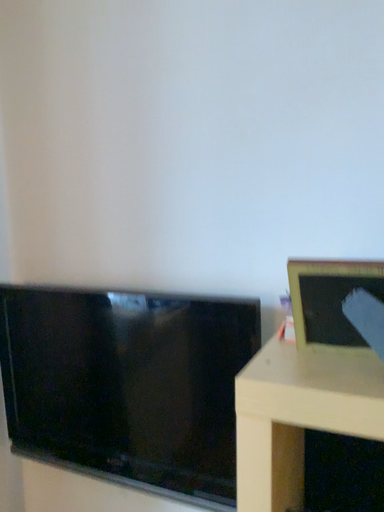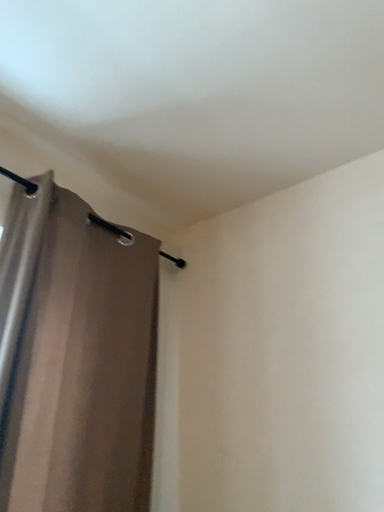
Question: Which way did the camera rotate in the video?

Choices:
 (A) rotated right
 (B) rotated left

Answer: (B)